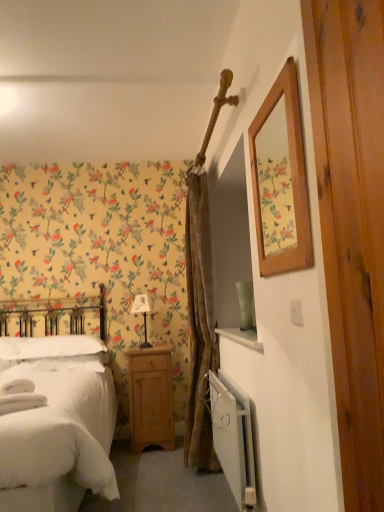
Find the location of a particular element. Image resolution: width=384 pixels, height=512 pixels. free space to the left of brown textured curtain at center is located at coordinates (161, 484).